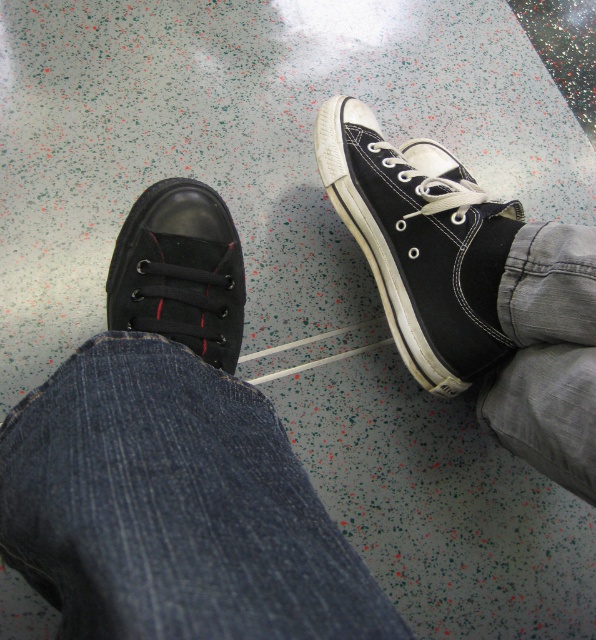
This screenshot has width=596, height=640. Describe the element at coordinates (420, 243) in the screenshot. I see `matte canvas sneaker at upper center` at that location.

Measure the distance between point (383,225) and camera.

The distance of point (383,225) from camera is 34.72 inches.

This screenshot has width=596, height=640. In order to click on matte canvas sneaker at upper center in this screenshot , I will do `click(420, 243)`.